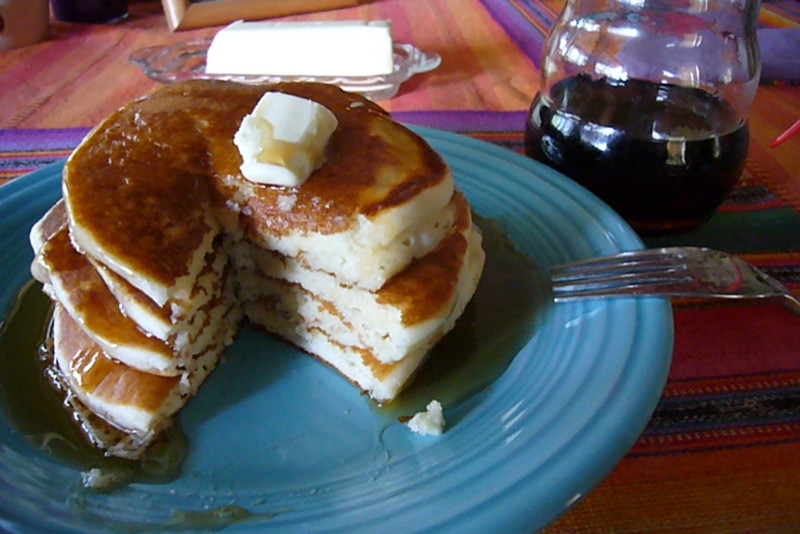
The height and width of the screenshot is (534, 800). In order to click on butter dish in this screenshot , I will do `click(380, 89)`.